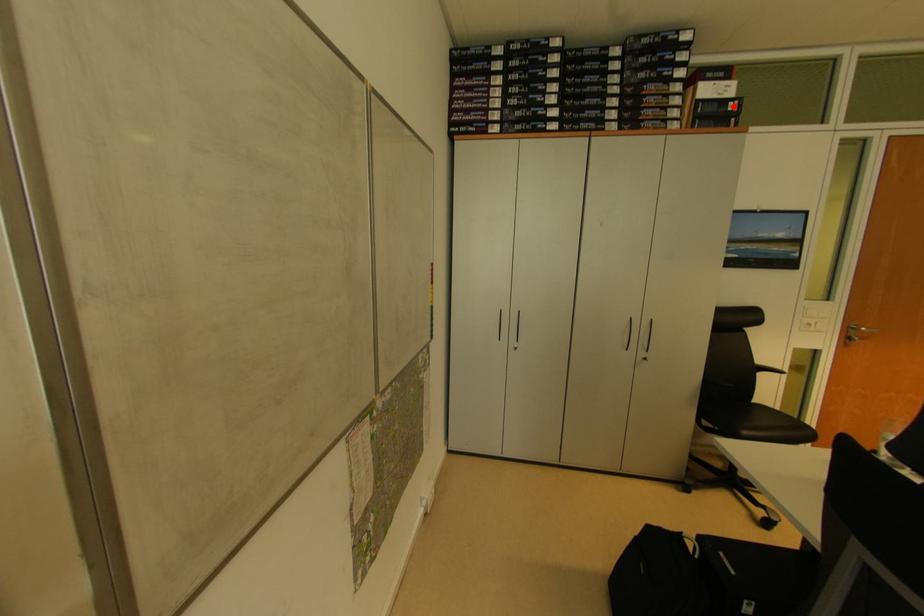
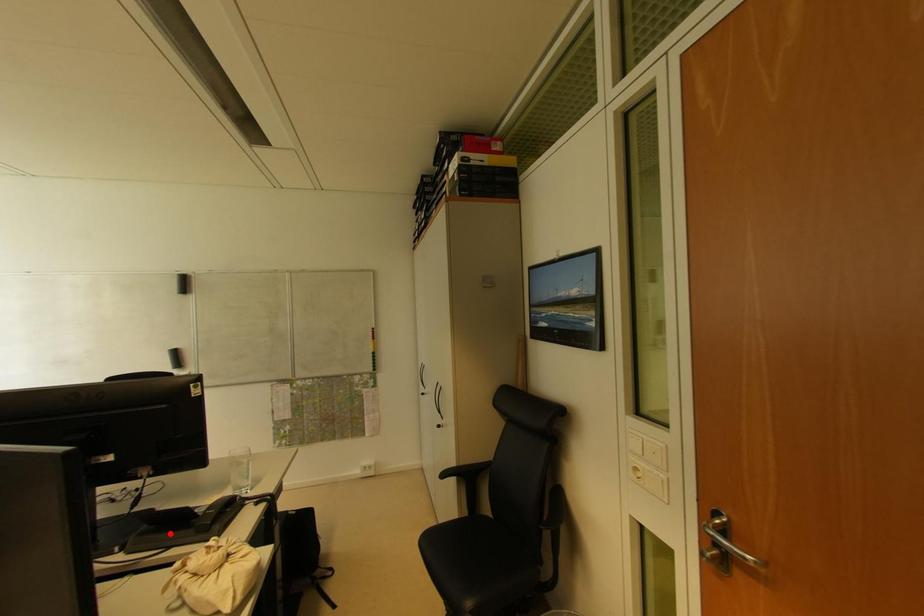
I am providing you with two images of the same scene from different viewpoints. A red point is marked on the first image and another point is marked on the second image. Do the highlighted points in image1 and image2 indicate the same real-world spot?

No